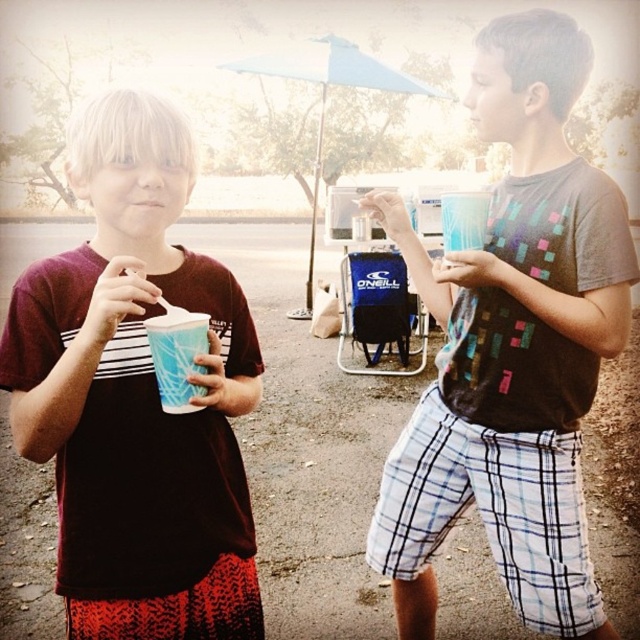
Question: Among these objects, which one is farthest from the camera?

Choices:
 (A) blue paper cup at left
 (B) blue fabric umbrella at center
 (C) matte plastic cup at center

Answer: (B)

Question: Which of these objects is positioned farthest from the blue paper cup at left?

Choices:
 (A) blue fabric umbrella at center
 (B) matte plastic cup at center

Answer: (A)

Question: Which point is closer to the camera?

Choices:
 (A) blue fabric umbrella at center
 (B) blue paper cup at left
 (C) matte plastic cup at center

Answer: (C)

Question: Is matte plastic cup at right bigger than matte plastic cup at center?

Choices:
 (A) no
 (B) yes

Answer: (B)

Question: In this image, where is blue fabric umbrella at center located relative to blue paper cup at left?

Choices:
 (A) above
 (B) below

Answer: (A)

Question: From the image, what is the correct spatial relationship of matte plastic cup at right in relation to blue paper cup at left?

Choices:
 (A) right
 (B) left

Answer: (A)